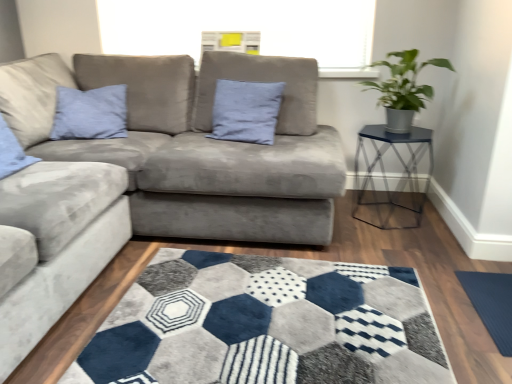
Question: Should I look upward or downward to see metal hexagonal table at right?

Choices:
 (A) up
 (B) down

Answer: (A)

Question: Does suede blue pillow at center have a greater width compared to metal hexagonal table at right?

Choices:
 (A) yes
 (B) no

Answer: (B)

Question: Can you confirm if suede blue pillow at center is bigger than metal hexagonal table at right?

Choices:
 (A) yes
 (B) no

Answer: (B)

Question: Considering the relative positions of suede blue pillow at center and metal hexagonal table at right in the image provided, is suede blue pillow at center to the right of metal hexagonal table at right from the viewer's perspective?

Choices:
 (A) no
 (B) yes

Answer: (A)

Question: Is suede blue pillow at center aimed at metal hexagonal table at right?

Choices:
 (A) yes
 (B) no

Answer: (B)

Question: Is suede blue pillow at center in front of metal hexagonal table at right?

Choices:
 (A) yes
 (B) no

Answer: (B)

Question: Is suede blue pillow at center smaller than metal hexagonal table at right?

Choices:
 (A) yes
 (B) no

Answer: (A)

Question: From a real-world perspective, is metal hexagonal table at right on dark blue textured yoga mat at lower right?

Choices:
 (A) yes
 (B) no

Answer: (A)

Question: Does metal hexagonal table at right have a greater width compared to dark blue textured yoga mat at lower right?

Choices:
 (A) yes
 (B) no

Answer: (A)

Question: Does metal hexagonal table at right have a larger size compared to dark blue textured yoga mat at lower right?

Choices:
 (A) no
 (B) yes

Answer: (B)

Question: Does metal hexagonal table at right have a lesser width compared to dark blue textured yoga mat at lower right?

Choices:
 (A) no
 (B) yes

Answer: (A)

Question: Is metal hexagonal table at right surrounding dark blue textured yoga mat at lower right?

Choices:
 (A) no
 (B) yes

Answer: (A)

Question: Would you say metal hexagonal table at right is a long distance from dark blue textured yoga mat at lower right?

Choices:
 (A) no
 (B) yes

Answer: (A)

Question: Is green matte plant at upper right facing away from metal hexagonal table at right?

Choices:
 (A) yes
 (B) no

Answer: (B)